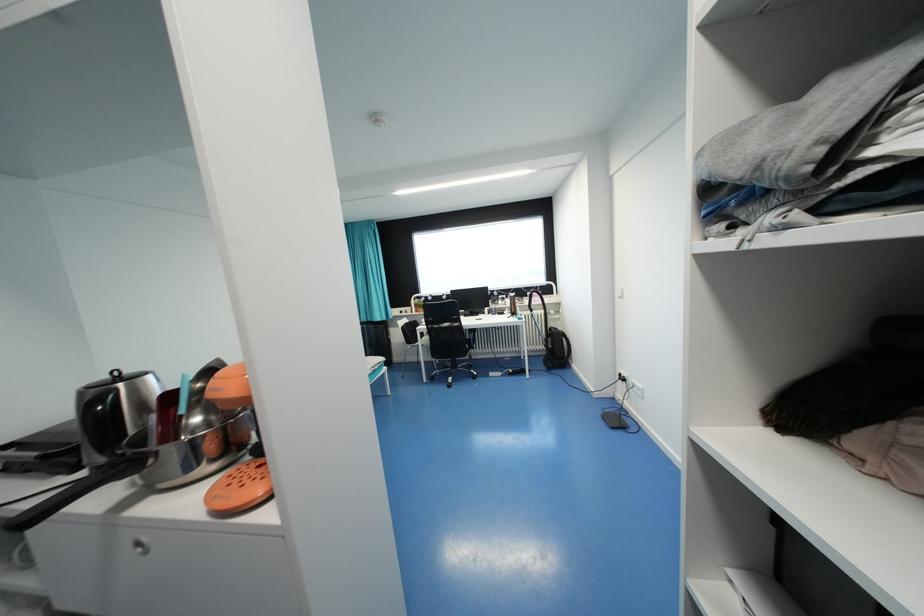
This screenshot has width=924, height=616. Describe the element at coordinates (91, 419) in the screenshot. I see `the kettle handle` at that location.